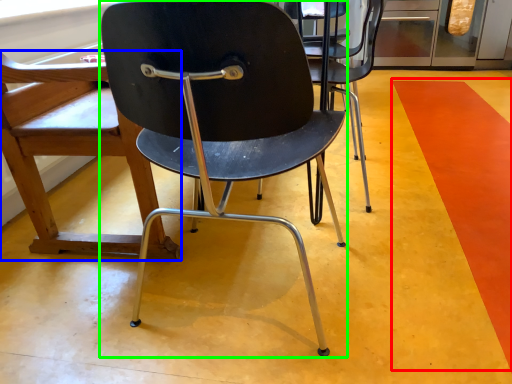
Question: Considering the real-world distances, which object is closest to strip (highlighted by a red box)? chair (highlighted by a blue box) or chair (highlighted by a green box).

Choices:
 (A) chair
 (B) chair

Answer: (B)